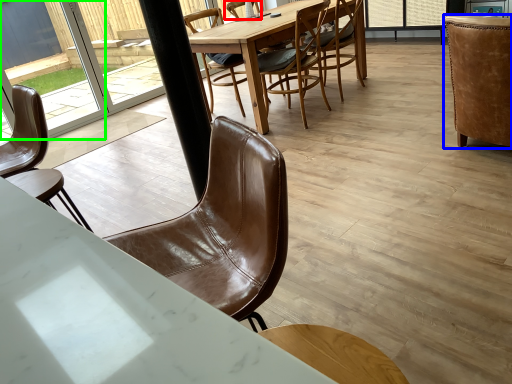
Question: Which is nearer to the chair (highlighted by a red box)? chair (highlighted by a blue box) or glass door (highlighted by a green box).

Choices:
 (A) chair
 (B) glass door

Answer: (A)